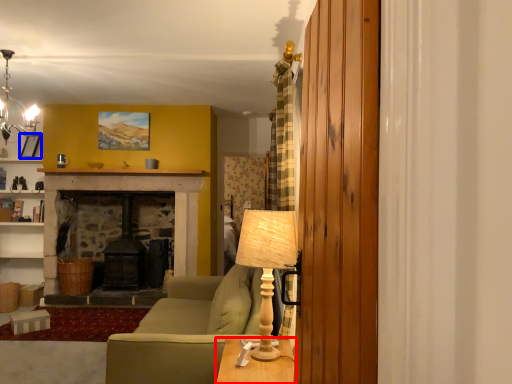
Question: Among these objects, which one is nearest to the camera, table (highlighted by a red box) or picture frame (highlighted by a blue box)?

Choices:
 (A) table
 (B) picture frame

Answer: (A)